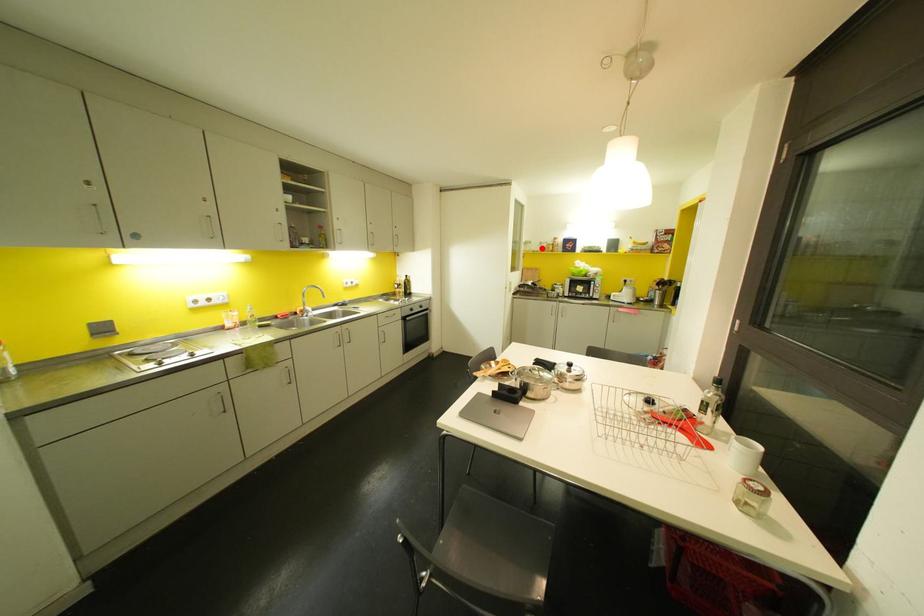
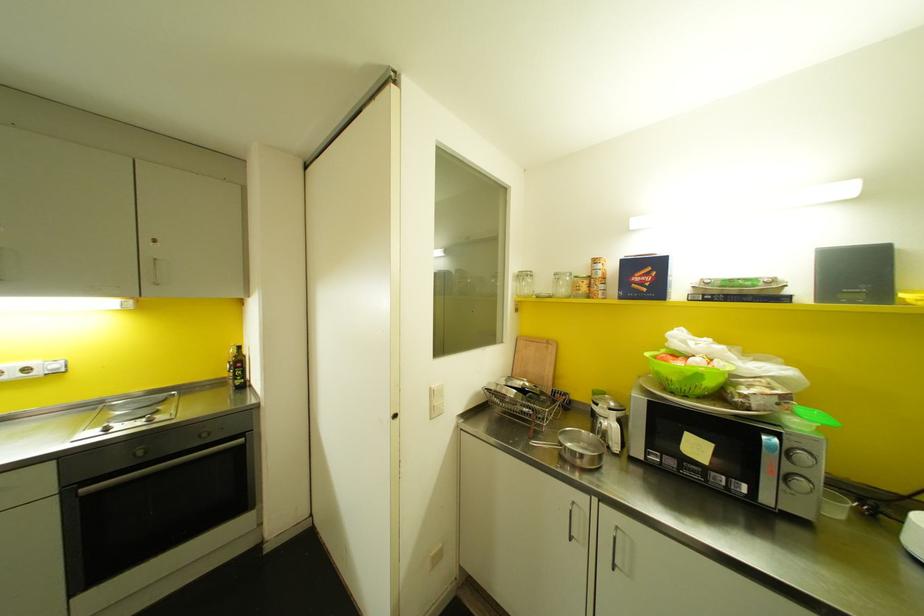
Question: I am providing you with two images of the same scene from different viewpoints. Given a red point in image1, look at the same physical point in image2. Is it:

Choices:
 (A) Closer to the viewpoint
 (B) Farther from the viewpoint

Answer: (B)